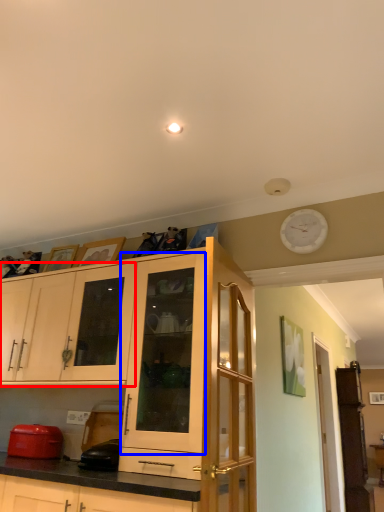
Question: Which object is closer to the camera taking this photo, cabinetry (highlighted by a red box) or cabinetry (highlighted by a blue box)?

Choices:
 (A) cabinetry
 (B) cabinetry

Answer: (B)